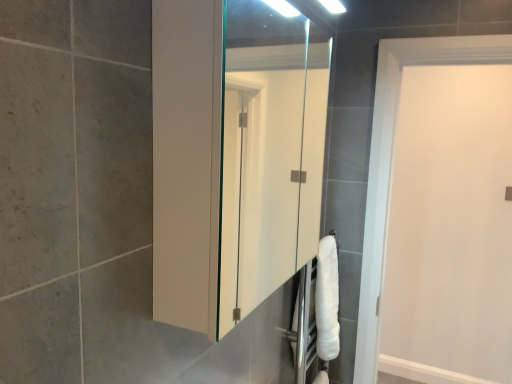
Question: Is white matte door at right spatially inside white glossy cabinet at center, or outside of it?

Choices:
 (A) inside
 (B) outside

Answer: (B)

Question: Based on their sizes in the image, would you say white matte door at right is bigger or smaller than white glossy cabinet at center?

Choices:
 (A) big
 (B) small

Answer: (A)

Question: Visually, is white matte door at right positioned to the left or to the right of white glossy cabinet at center?

Choices:
 (A) left
 (B) right

Answer: (B)

Question: Is point (307, 233) closer or farther from the camera than point (496, 304)?

Choices:
 (A) farther
 (B) closer

Answer: (A)

Question: Is white glossy cabinet at center in front of or behind white matte door at right in the image?

Choices:
 (A) behind
 (B) front

Answer: (B)

Question: Is white glossy cabinet at center inside or outside of white matte door at right?

Choices:
 (A) outside
 (B) inside

Answer: (A)

Question: Based on their sizes in the image, would you say white glossy cabinet at center is bigger or smaller than white matte door at right?

Choices:
 (A) small
 (B) big

Answer: (A)